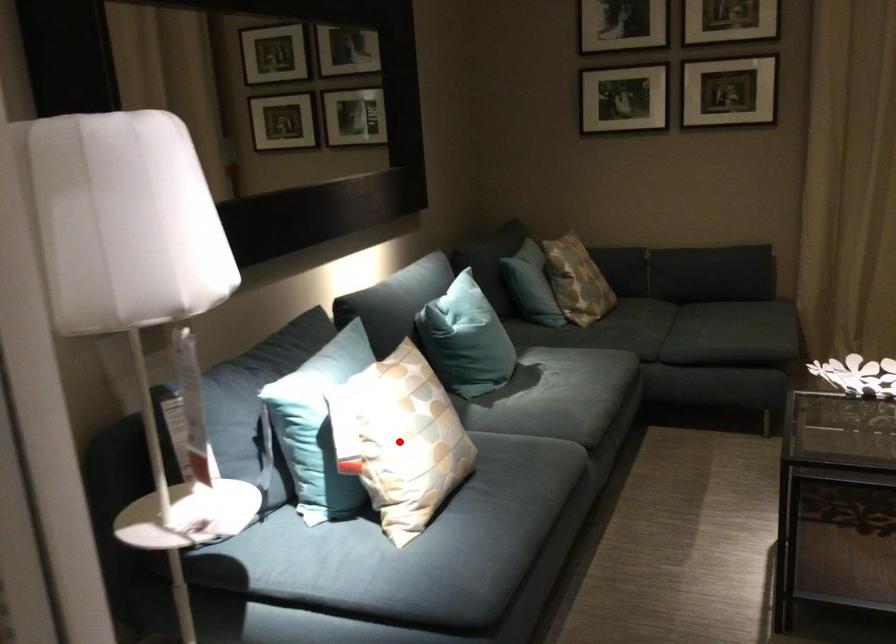
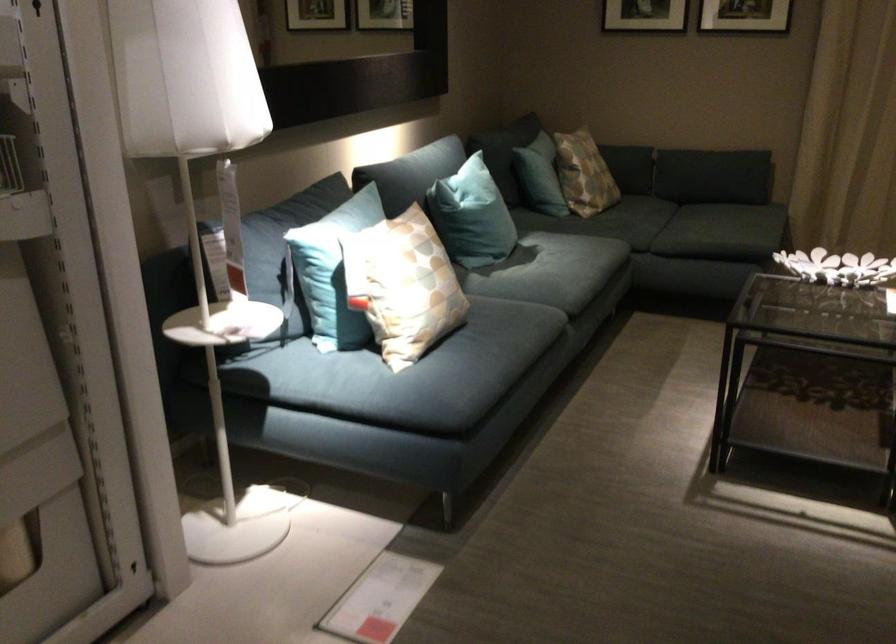
The point at the highlighted location is marked in the first image. Where is the corresponding point in the second image?

(402, 285)